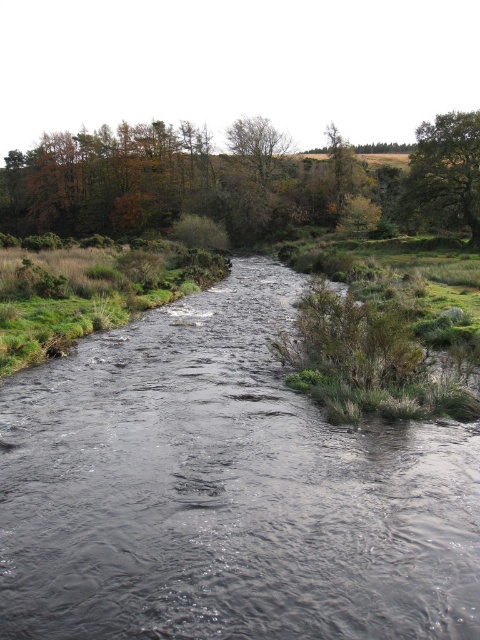
Looking at this image, is black water at center to the left of green leafy tree at upper right from the viewer's perspective?

Yes, black water at center is to the left of green leafy tree at upper right.

Between black water at center and green leafy tree at upper right, which one appears on the left side from the viewer's perspective?

black water at center

Image resolution: width=480 pixels, height=640 pixels. In order to click on black water at center in this screenshot , I will do `click(225, 490)`.

Who is more forward, (169, 541) or (262, 182)?

Point (169, 541) is in front.

Which is below, black water at center or green leafy tree at upper center?

Positioned lower is black water at center.

At what (x,y) coordinates should I click in order to perform the action: click on black water at center. Please return your answer as a coordinate pair (x, y). The image size is (480, 640). Looking at the image, I should click on (225, 490).

Find the location of a particular element. black water at center is located at coordinates (225, 490).

Does green leafy tree at upper right have a greater width compared to green leafy tree at upper center?

Incorrect, green leafy tree at upper right's width does not surpass green leafy tree at upper center's.

In the scene shown: Is green leafy tree at upper right to the left of green leafy tree at upper center from the viewer's perspective?

No, green leafy tree at upper right is not to the left of green leafy tree at upper center.

Who is more forward, (465, 186) or (231, 148)?

Positioned in front is point (465, 186).

Where is `green leafy tree at upper right`? The width and height of the screenshot is (480, 640). green leafy tree at upper right is located at coordinates (445, 173).